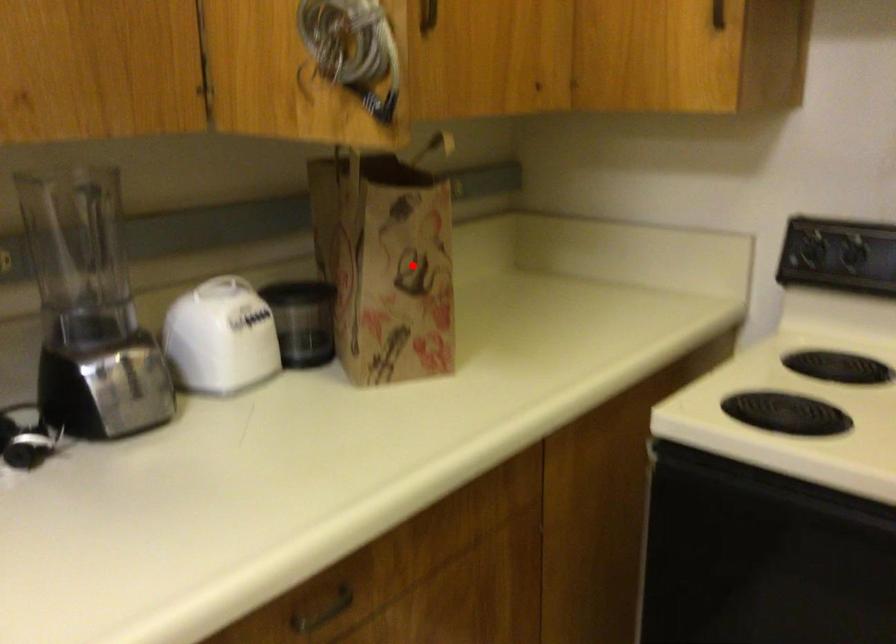
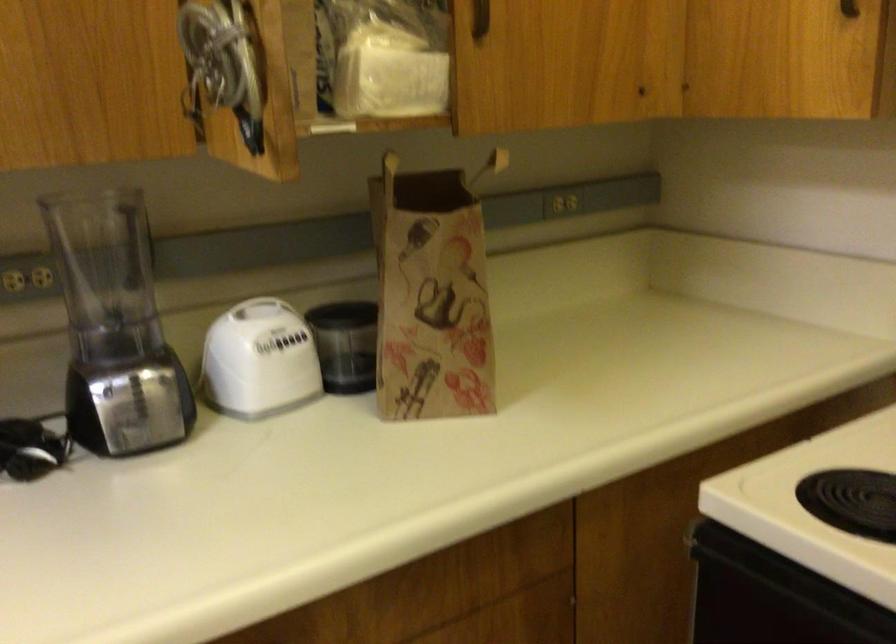
Locate, in the second image, the point that corresponds to the highlighted location in the first image.

(431, 295)